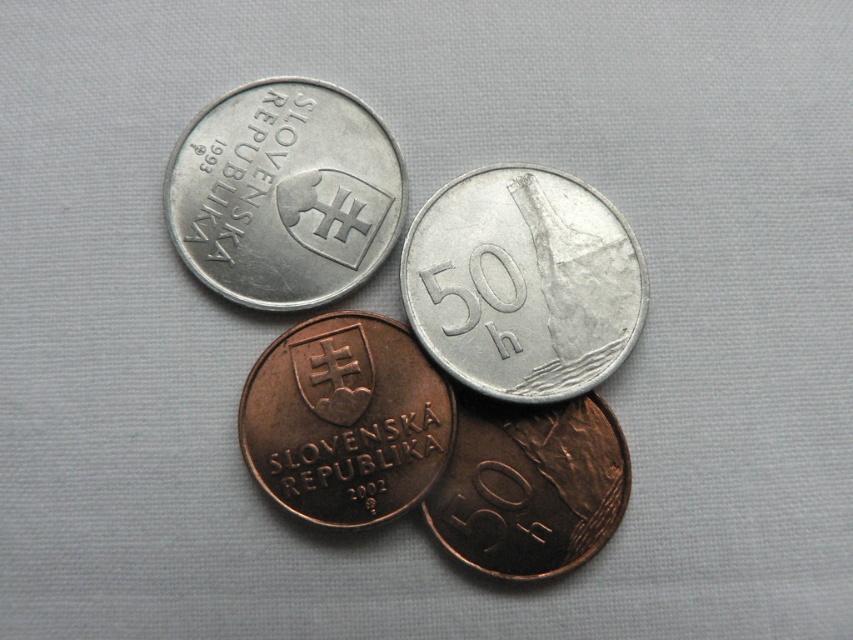
You are a coin collector examining the coins on the light gray surface. You notice the silver metallic coin at upper right and the bronze metallic coin at center. Which coin do you think has a larger diameter?

The silver metallic coin at upper right might be wider than bronze metallic coin at center, so it likely has a larger diameter.